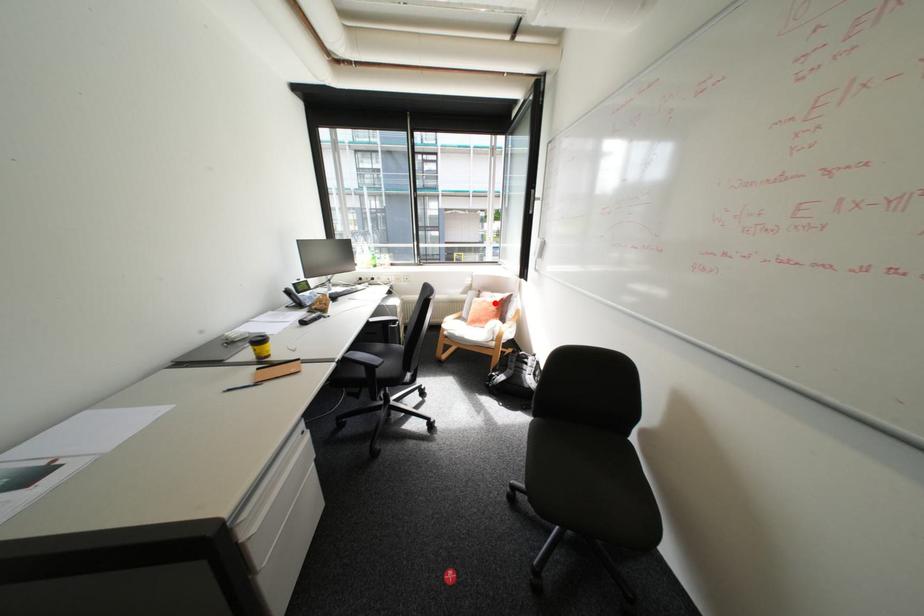
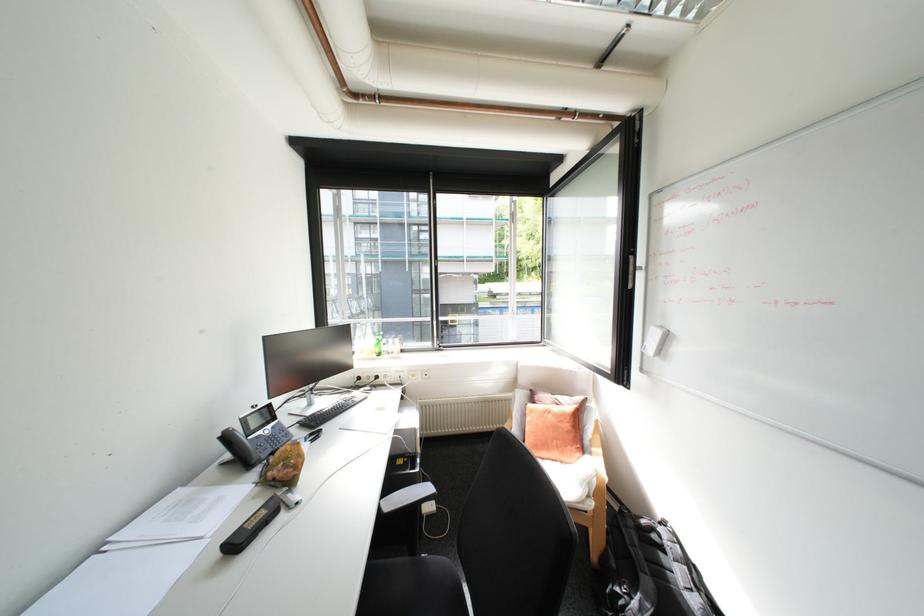
In the second image, find the point that corresponds to the highlighted location in the first image.

(561, 416)